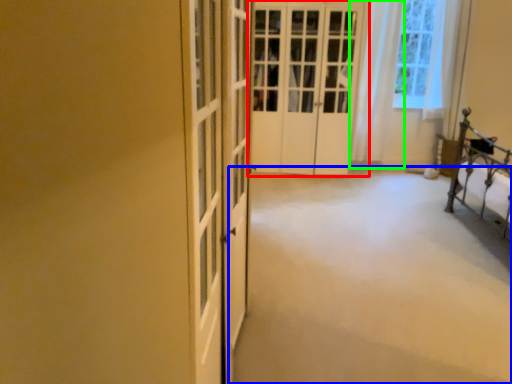
Question: Which object is the farthest from door (highlighted by a red box)? Choose among these: plain (highlighted by a blue box) or curtain (highlighted by a green box).

Choices:
 (A) plain
 (B) curtain

Answer: (A)